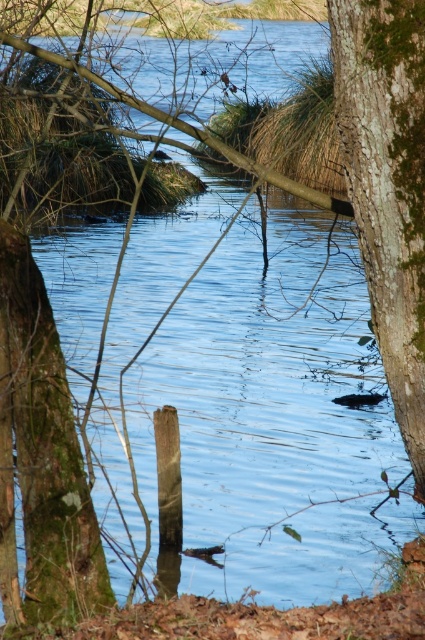
Based on the photo, you are standing in the scene and see the green mossy bark at right and the green mossy tree trunk at lower left. Which one is located to the right of the other?

The green mossy bark at right is positioned on the right side of the green mossy tree trunk at lower left.

You are standing at the edge of the water in the scene and want to place a small rock on the green mossy bark at right and the green mossy tree trunk at lower left. Which surface can you reach without bending down?

The green mossy tree trunk at lower left is located lower than the green mossy bark at right, so you can reach it without bending down.

Based on the photo, you are standing at the edge of the water in the scene. There is a point marked at coordinates point (388, 186). What does this point represent?

The point (388, 186) represents the green mossy bark at right.